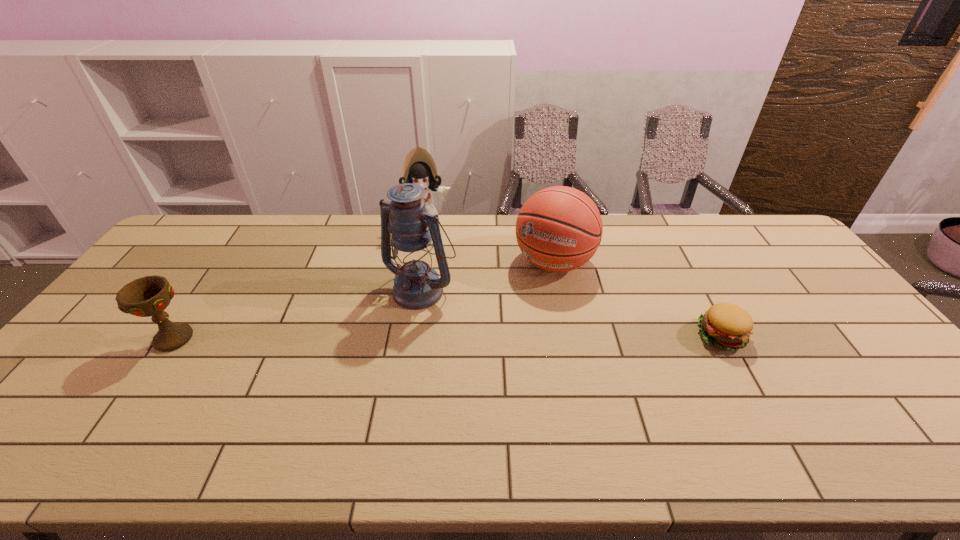
Where is `the leftmost object`? The width and height of the screenshot is (960, 540). the leftmost object is located at coordinates (148, 296).

Where is `the fourth tallest object`? Image resolution: width=960 pixels, height=540 pixels. the fourth tallest object is located at coordinates (148, 296).

You are a GUI agent. You are given a task and a screenshot of the screen. Output one action in this format:
    pyautogui.click(x=<x>, y=<y>)
    Task: Click on the rightmost object
    Image resolution: width=960 pixels, height=540 pixels.
    Given the screenshot: What is the action you would take?
    pyautogui.click(x=726, y=326)

Locate an element on the screen. the shortest object is located at coordinates (726, 326).

This screenshot has width=960, height=540. What are the coordinates of `basketball` in the screenshot? It's located at (558, 229).

Identify the location of lantern. (417, 286).

At what (x,y) coordinates should I click in order to perform the action: click on doll. Please return your answer as a coordinate pair (x, y). Looking at the image, I should click on (419, 167).

Locate an element on the screen. This screenshot has height=540, width=960. vacant space located on the right of the chalice is located at coordinates (225, 339).

Image resolution: width=960 pixels, height=540 pixels. I want to click on free space located 0.300m on the left of the rightmost object, so click(x=588, y=336).

Locate an element on the screen. The height and width of the screenshot is (540, 960). free space located on the logo side of the second object from right to left is located at coordinates (486, 368).